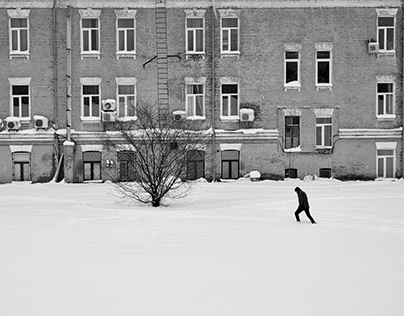
The image size is (404, 316). What are the coordinates of `ladder` in the screenshot? It's located at (163, 59).